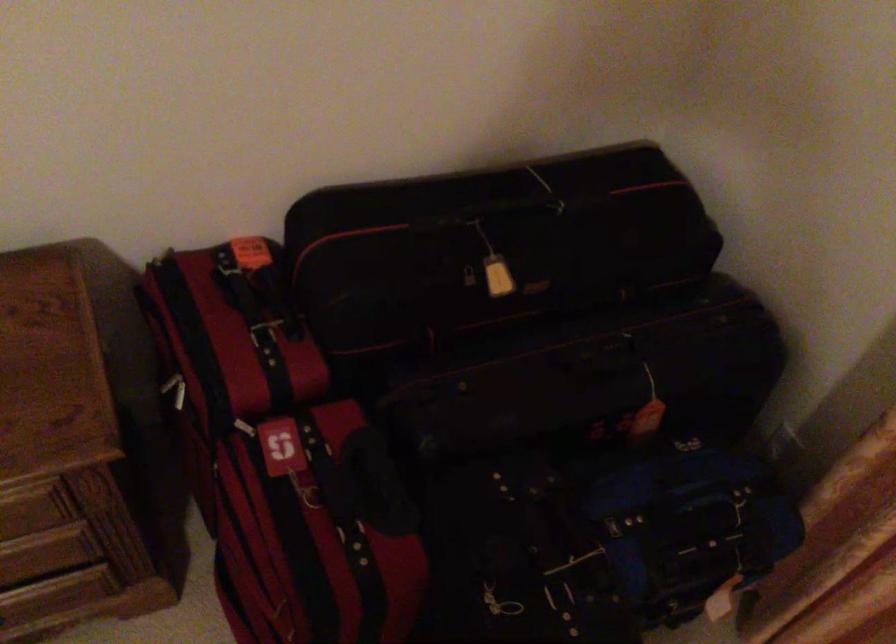
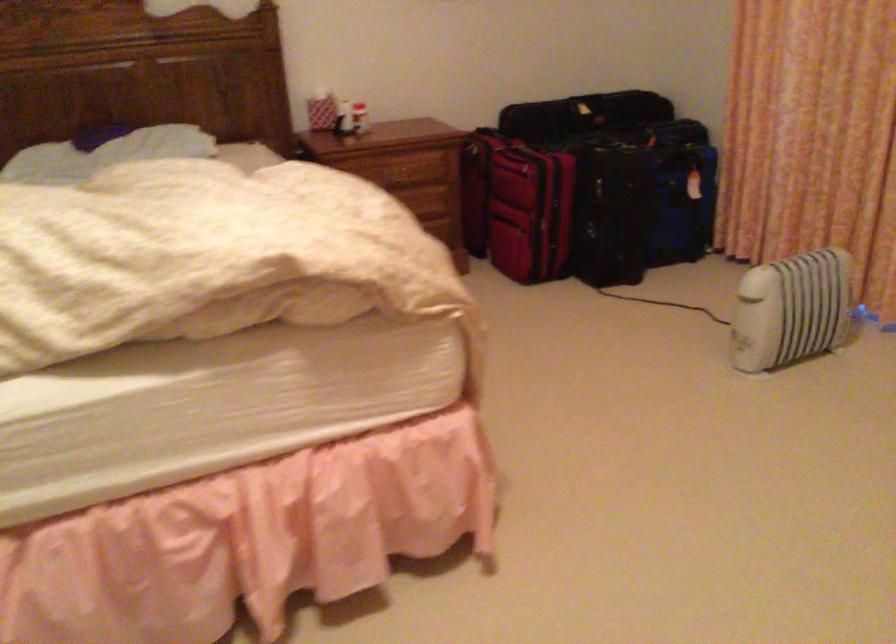
Question: What movement of the cameraman would produce the second image?

Choices:
 (A) Left
 (B) Right
 (C) Forward
 (D) Backward

Answer: (D)